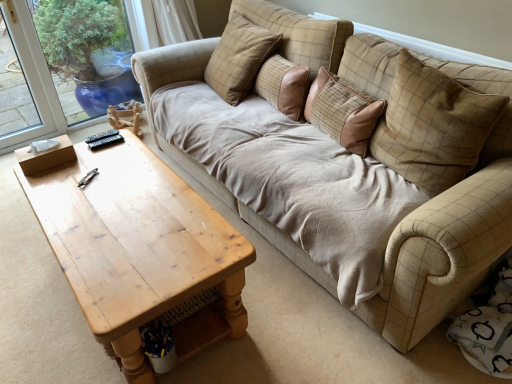
Question: Is brown fabric pillow at center, placed as the 2th pillow when sorted from left to right, positioned beyond the bounds of light brown wooden coffee table at left?

Choices:
 (A) no
 (B) yes

Answer: (B)

Question: From a real-world perspective, is brown fabric pillow at center, the third pillow viewed from the right, positioned under light brown wooden coffee table at left based on gravity?

Choices:
 (A) yes
 (B) no

Answer: (B)

Question: From the image's perspective, would you say brown fabric pillow at center, the third pillow viewed from the right, is positioned over light brown wooden coffee table at left?

Choices:
 (A) yes
 (B) no

Answer: (A)

Question: Can you confirm if brown fabric pillow at center, the third pillow viewed from the right, is thinner than light brown wooden coffee table at left?

Choices:
 (A) yes
 (B) no

Answer: (A)

Question: Is brown fabric pillow at center, placed as the 2th pillow when sorted from left to right, shorter than light brown wooden coffee table at left?

Choices:
 (A) yes
 (B) no

Answer: (A)

Question: Is beige checkered pillow at upper center, the third pillow viewed from the left, in front of or behind brown fabric pillow at center, placed as the 2th pillow when sorted from left to right, in the image?

Choices:
 (A) behind
 (B) front

Answer: (B)

Question: From the image's perspective, is beige checkered pillow at upper center, which is the second pillow in right-to-left order, positioned above or below brown fabric pillow at center, placed as the 2th pillow when sorted from left to right?

Choices:
 (A) above
 (B) below

Answer: (B)

Question: Is beige checkered pillow at upper center, the third pillow viewed from the left, to the left or to the right of brown fabric pillow at center, placed as the 2th pillow when sorted from left to right, in the image?

Choices:
 (A) right
 (B) left

Answer: (A)

Question: Does point (321, 120) appear closer or farther from the camera than point (262, 71)?

Choices:
 (A) closer
 (B) farther

Answer: (A)

Question: From a real-world perspective, is plaid fabric pillow at upper right, which is the fourth pillow from left to right, above or below light brown wooden coffee table at left?

Choices:
 (A) above
 (B) below

Answer: (A)

Question: In terms of size, does plaid fabric pillow at upper right, which is the fourth pillow from left to right, appear bigger or smaller than light brown wooden coffee table at left?

Choices:
 (A) small
 (B) big

Answer: (A)

Question: Considering the positions of plaid fabric pillow at upper right, which is the fourth pillow from left to right, and light brown wooden coffee table at left in the image, is plaid fabric pillow at upper right, which is the fourth pillow from left to right, taller or shorter than light brown wooden coffee table at left?

Choices:
 (A) short
 (B) tall

Answer: (B)

Question: In the image, is plaid fabric pillow at upper right, which is the fourth pillow from left to right, positioned in front of or behind light brown wooden coffee table at left?

Choices:
 (A) front
 (B) behind

Answer: (B)

Question: Is brown fabric pillow at center, the third pillow viewed from the right, inside the boundaries of beige fabric couch at center, or outside?

Choices:
 (A) outside
 (B) inside

Answer: (A)

Question: Considering the positions of point (281, 87) and point (293, 56), is point (281, 87) closer or farther from the camera than point (293, 56)?

Choices:
 (A) farther
 (B) closer

Answer: (B)